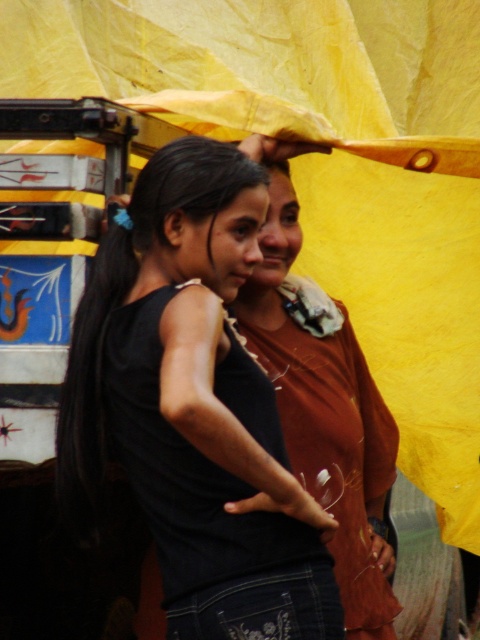
Between black matte tank top at center and matte brown shirt at center, which one has more height?

Standing taller between the two is matte brown shirt at center.

At what (x,y) coordinates should I click in order to perform the action: click on black matte tank top at center. Please return your answer as a coordinate pair (x, y). Looking at the image, I should click on (192, 406).

Where is `black matte tank top at center`? The width and height of the screenshot is (480, 640). black matte tank top at center is located at coordinates (192, 406).